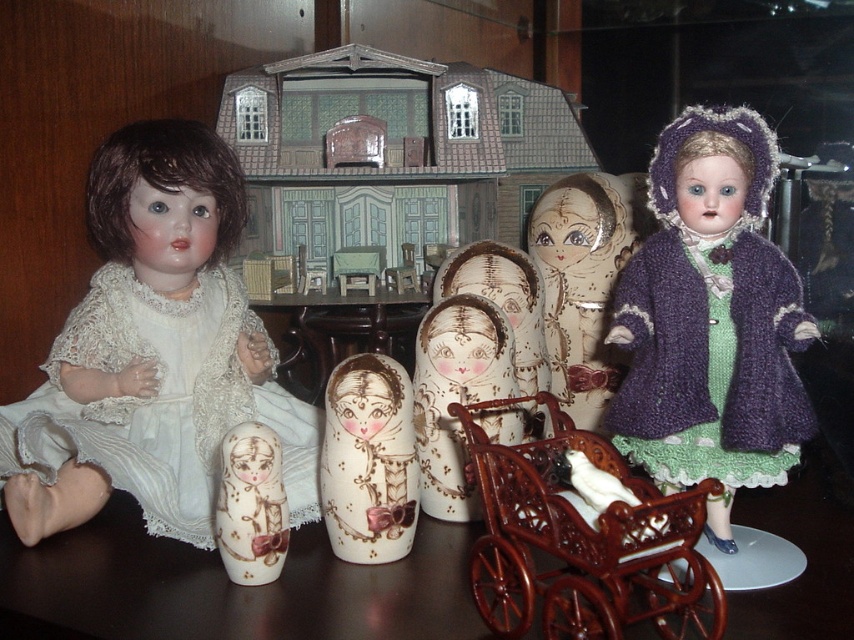
You are a toy collector who wants to place a new doll between the shiny brown wooden table at center and the white lace dress at left. The new doll is 6 inches wide. Will it fit in the space between them?

The space between the shiny brown wooden table at center and the white lace dress at left is 6.24 inches. Since the new doll is 6 inches wide, it will fit as the space is slightly larger than the doll.

You are a collector organizing a display of dolls. You have the white lace dress at left and the wooden doll at center. Which object is placed on top of the other?

The white lace dress at left is positioned over the wooden doll at center, so the white lace dress at left is placed on top of the wooden doll at center.